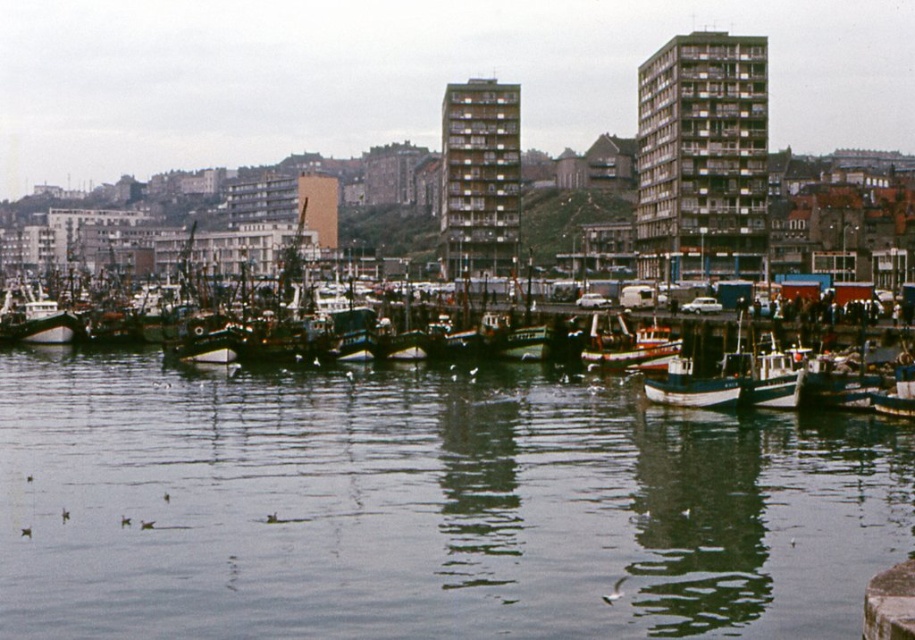
You are standing at the edge of the harbor and want to take a photo of the clear water at center. Where exactly should you aim your camera to capture it?

You should aim your camera at point coordinates of (427, 508) to capture the clear water at center.

You are standing on the dock and looking out at the harbor. Which object is closer to you between the clear water at center and the wooden fishing boat at center?

The clear water at center is closer to you because it is in front of the wooden fishing boat at center.